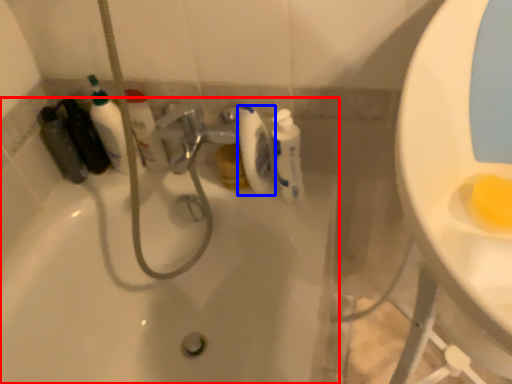
Question: Among these objects, which one is nearest to the camera, bathtub (highlighted by a red box) or toilet paper (highlighted by a blue box)?

Choices:
 (A) bathtub
 (B) toilet paper

Answer: (A)